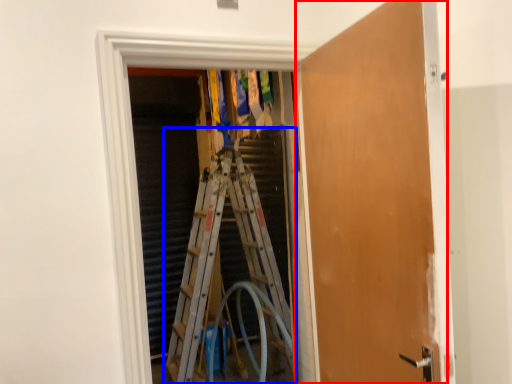
Question: Which object appears closest to the camera in this image, door (highlighted by a red box) or ladder (highlighted by a blue box)?

Choices:
 (A) door
 (B) ladder

Answer: (A)